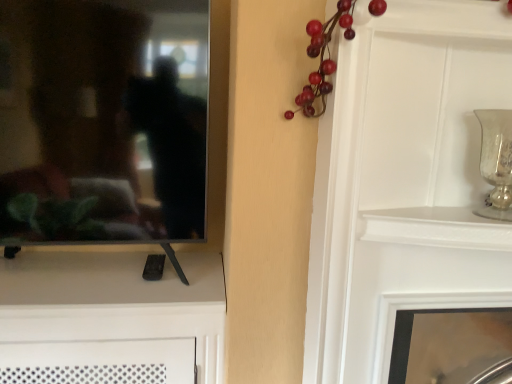
Question: Is black glossy mirror at left at the left side of white glossy fireplace at lower right?

Choices:
 (A) yes
 (B) no

Answer: (A)

Question: Is black glossy mirror at left positioned in front of white glossy fireplace at lower right?

Choices:
 (A) yes
 (B) no

Answer: (A)

Question: Is black glossy mirror at left taller than white glossy fireplace at lower right?

Choices:
 (A) no
 (B) yes

Answer: (B)

Question: Considering the relative sizes of black glossy mirror at left and white glossy fireplace at lower right in the image provided, is black glossy mirror at left smaller than white glossy fireplace at lower right?

Choices:
 (A) yes
 (B) no

Answer: (A)

Question: Is black glossy mirror at left next to white glossy fireplace at lower right and touching it?

Choices:
 (A) no
 (B) yes

Answer: (A)

Question: Does black glossy mirror at left turn towards white glossy fireplace at lower right?

Choices:
 (A) yes
 (B) no

Answer: (B)

Question: Does silver textured vase at upper right have a greater width compared to white glossy fireplace at lower right?

Choices:
 (A) no
 (B) yes

Answer: (A)

Question: Does silver textured vase at upper right have a lesser height compared to white glossy fireplace at lower right?

Choices:
 (A) yes
 (B) no

Answer: (A)

Question: Is there a large distance between silver textured vase at upper right and white glossy fireplace at lower right?

Choices:
 (A) no
 (B) yes

Answer: (A)

Question: Does silver textured vase at upper right have a larger size compared to white glossy fireplace at lower right?

Choices:
 (A) yes
 (B) no

Answer: (B)

Question: Is silver textured vase at upper right next to white glossy fireplace at lower right?

Choices:
 (A) no
 (B) yes

Answer: (A)

Question: Is silver textured vase at upper right facing away from white glossy fireplace at lower right?

Choices:
 (A) yes
 (B) no

Answer: (B)

Question: Considering the relative sizes of silver textured vase at upper right and black glossy mirror at left in the image provided, is silver textured vase at upper right wider than black glossy mirror at left?

Choices:
 (A) yes
 (B) no

Answer: (B)